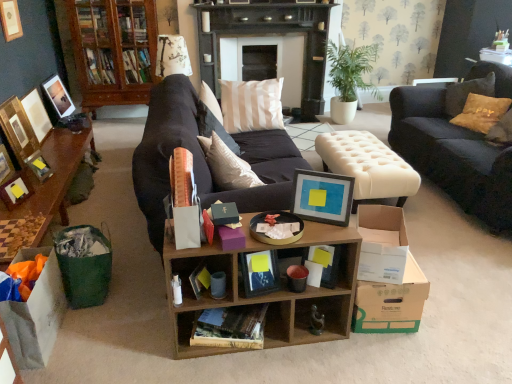
Describe the element at coordinates (367, 166) in the screenshot. I see `cream tufted ottoman at center` at that location.

Locate an element on the screen. This screenshot has height=384, width=512. matte plastic picture frame at center, which is the eighth picture frame in left-to-right order is located at coordinates (322, 197).

In order to face matte white picture frame at left, marked as the fifth picture frame in a right-to-left arrangement, should I rotate leftwards or rightwards?

Rotate your view left by about 28.859°.

Locate an element on the screen. This screenshot has height=384, width=512. green leafy plant at center is located at coordinates (349, 78).

Where is `cream tufted ottoman at center`? Image resolution: width=512 pixels, height=384 pixels. cream tufted ottoman at center is located at coordinates (367, 166).

Which object is wider, matte black picture frame at left, marked as the fifth picture frame in a left-to-right arrangement, or wooden cube shelf at center, which appears as the 2th shelf when viewed from the left?

Wider between the two is wooden cube shelf at center, which appears as the 2th shelf when viewed from the left.

Is matte black picture frame at left, the 4th picture frame in the right-to-left sequence, bigger or smaller than wooden cube shelf at center, arranged as the first shelf when viewed from the right?

In the image, matte black picture frame at left, the 4th picture frame in the right-to-left sequence, appears to be smaller than wooden cube shelf at center, arranged as the first shelf when viewed from the right.

Is matte black picture frame at left, the 4th picture frame in the right-to-left sequence, far away from wooden cube shelf at center, which appears as the 2th shelf when viewed from the left?

Indeed, matte black picture frame at left, the 4th picture frame in the right-to-left sequence, is not near wooden cube shelf at center, which appears as the 2th shelf when viewed from the left.

From the picture: Would you say matte black picture frame at left, marked as the fifth picture frame in a left-to-right arrangement, contains wooden cube shelf at center, arranged as the first shelf when viewed from the right?

No, wooden cube shelf at center, arranged as the first shelf when viewed from the right, is not a part of matte black picture frame at left, marked as the fifth picture frame in a left-to-right arrangement.

From the picture: Is matte black book at center, positioned as the 2th book in bottom-to-top order, not near dark wood fireplace at center?

Yes, matte black book at center, positioned as the 2th book in bottom-to-top order, and dark wood fireplace at center are quite far apart.

Is matte black book at center, which is the 1th book in top-to-bottom order, oriented away from dark wood fireplace at center?

Absolutely, matte black book at center, which is the 1th book in top-to-bottom order, is directed away from dark wood fireplace at center.

Is point (265, 259) closer to viewer compared to point (317, 39)?

Yes, point (265, 259) is in front of point (317, 39).

Is the position of matte black book at center, which is the 1th book in top-to-bottom order, more distant than that of dark wood fireplace at center?

No, it is in front of dark wood fireplace at center.

In the image, is wooden cube shelf at center, which appears as the 2th shelf when viewed from the right, positioned in front of or behind wooden cabinet at upper left?

wooden cube shelf at center, which appears as the 2th shelf when viewed from the right, is in front of wooden cabinet at upper left.

From the image's perspective, would you say wooden cube shelf at center, the first shelf viewed from the left, is positioned over wooden cabinet at upper left?

No, from the image's perspective, wooden cube shelf at center, the first shelf viewed from the left, is not on top of wooden cabinet at upper left.

From a real-world perspective, who is located lower, wooden cube shelf at center, the first shelf viewed from the left, or wooden cabinet at upper left?

wooden cube shelf at center, the first shelf viewed from the left, from a real-world perspective.

Who is bigger, wooden cube shelf at center, which appears as the 2th shelf when viewed from the right, or wooden cabinet at upper left?

With larger size is wooden cabinet at upper left.

Is matte black picture frame at left, the 4th picture frame in the right-to-left sequence, completely or partially outside of cream tufted ottoman at center?

matte black picture frame at left, the 4th picture frame in the right-to-left sequence, is positioned outside cream tufted ottoman at center.

Is matte black picture frame at left, marked as the fifth picture frame in a left-to-right arrangement, smaller than cream tufted ottoman at center?

Yes.

Is matte black picture frame at left, marked as the fifth picture frame in a left-to-right arrangement, wider than cream tufted ottoman at center?

Incorrect, the width of matte black picture frame at left, marked as the fifth picture frame in a left-to-right arrangement, does not surpass that of cream tufted ottoman at center.

In the scene shown: Are matte black picture frame at left, the 4th picture frame in the right-to-left sequence, and cream tufted ottoman at center far apart?

Yes, matte black picture frame at left, the 4th picture frame in the right-to-left sequence, and cream tufted ottoman at center are quite far apart.

Which object is further away from the camera taking this photo, cream tufted ottoman at center or matte black picture frame at left, the 3th picture frame viewed from the right?

cream tufted ottoman at center.

From the picture: Considering the relative sizes of cream tufted ottoman at center and matte black picture frame at left, arranged as the 6th picture frame when viewed from the left, in the image provided, is cream tufted ottoman at center smaller than matte black picture frame at left, arranged as the 6th picture frame when viewed from the left,?

Incorrect, cream tufted ottoman at center is not smaller in size than matte black picture frame at left, arranged as the 6th picture frame when viewed from the left.

Is cream tufted ottoman at center oriented towards matte black picture frame at left, the 3th picture frame viewed from the right?

No, cream tufted ottoman at center is not aimed at matte black picture frame at left, the 3th picture frame viewed from the right.

Which is behind, point (397, 155) or point (38, 174)?

The point (397, 155) is farther.

How different are the orientations of cardboard box at lower right, which ranks as the first cardboard box in right-to-left order, and matte black picture frame at upper left, which ranks as the 1th picture frame in left-to-right order, in degrees?

The angular difference between cardboard box at lower right, which ranks as the first cardboard box in right-to-left order, and matte black picture frame at upper left, which ranks as the 1th picture frame in left-to-right order, is 9.65 degrees.

Considering the points (387, 323) and (53, 100), which point is behind, point (387, 323) or point (53, 100)?

The point (53, 100) is more distant.

Does cardboard box at lower right, placed as the 3th cardboard box when sorted from left to right, have a greater height compared to matte black picture frame at upper left, the 8th picture frame from the right?

In fact, cardboard box at lower right, placed as the 3th cardboard box when sorted from left to right, may be shorter than matte black picture frame at upper left, the 8th picture frame from the right.

From the image's perspective, is cardboard box at lower right, placed as the 3th cardboard box when sorted from left to right, under matte black picture frame at upper left, the 8th picture frame from the right?

Yes.

Considering the positions of objects matte black picture frame at left, arranged as the 6th picture frame when viewed from the left, and white striped pillow at center in the image provided, who is more to the right, matte black picture frame at left, arranged as the 6th picture frame when viewed from the left, or white striped pillow at center?

white striped pillow at center is more to the right.

Are matte black picture frame at left, arranged as the 6th picture frame when viewed from the left, and white striped pillow at center far apart?

Yes.

From a real-world perspective, is matte black picture frame at left, arranged as the 6th picture frame when viewed from the left, below white striped pillow at center?

Yes, from a real-world perspective, matte black picture frame at left, arranged as the 6th picture frame when viewed from the left, is below white striped pillow at center.

From a real-world perspective, starting from the wooden cube shelf at center, arranged as the first shelf when viewed from the right, which picture frame is the 3rd one vertically above it? Please provide its 2D coordinates.

[(5, 165)]

Identify the location of entertainment center that appears on the right of matte black book at center, which is the 1th book in top-to-bottom order. (270, 33).

From the image, which object appears to be farther from matte black picture frame at left, marked as the 7th picture frame in a left-to-right arrangement, matte white picture frame at left, marked as the fifth picture frame in a right-to-left arrangement, or white paper bag at lower left, which ranks as the 3th cardboard box in right-to-left order?

white paper bag at lower left, which ranks as the 3th cardboard box in right-to-left order, is further to matte black picture frame at left, marked as the 7th picture frame in a left-to-right arrangement.

Which object lies further to the anchor point wooden cabinet at upper left, matte gold picture frame at upper left, the 7th picture frame positioned from the right, or matte black picture frame at left, arranged as the 6th picture frame when viewed from the left?

matte black picture frame at left, arranged as the 6th picture frame when viewed from the left, is positioned further to the anchor wooden cabinet at upper left.

Considering their positions, is matte black picture frame at left, the 4th picture frame in the right-to-left sequence, positioned closer to wooden cube shelf at center, which appears as the 2th shelf when viewed from the left, than cardboard box at center, arranged as the second cardboard box when viewed from the right?

cardboard box at center, arranged as the second cardboard box when viewed from the right, is closer to wooden cube shelf at center, which appears as the 2th shelf when viewed from the left.

Which object lies nearer to the anchor point dark wood fireplace at center, matte black picture frame at left, arranged as the 6th picture frame when viewed from the left, or green leafy plant at center?

green leafy plant at center lies closer to dark wood fireplace at center than the other object.

Estimate the real-world distances between objects in this image. Which object is closer to white paper bag at lower left, positioned as the first cardboard box in left-to-right order, matte gold picture frame at upper left, which is the 2th picture frame in left-to-right order, or matte black book at center, which is the 1th book in top-to-bottom order?

matte black book at center, which is the 1th book in top-to-bottom order, lies closer to white paper bag at lower left, positioned as the first cardboard box in left-to-right order, than the other object.

From the image, which object appears to be nearer to matte gold picture frame at upper left, the 7th picture frame positioned from the right, dark blue fabric couch at right or cream tufted ottoman at center?

cream tufted ottoman at center lies closer to matte gold picture frame at upper left, the 7th picture frame positioned from the right, than the other object.

Based on their spatial positions, is wooden cabinet at upper left or white striped pillow at center closer to matte white picture frame at left, marked as the fifth picture frame in a right-to-left arrangement?

The object closer to matte white picture frame at left, marked as the fifth picture frame in a right-to-left arrangement, is wooden cabinet at upper left.

Looking at this image, considering their positions, is matte black picture frame at upper left, the 8th picture frame from the right, positioned closer to cardboard box at lower right, placed as the 3th cardboard box when sorted from left to right, than wooden cube shelf at center, which appears as the 2th shelf when viewed from the left?

wooden cube shelf at center, which appears as the 2th shelf when viewed from the left, is positioned closer to the anchor cardboard box at lower right, placed as the 3th cardboard box when sorted from left to right.

You are a GUI agent. You are given a task and a screenshot of the screen. Output one action in this format:
    pyautogui.click(x=<x>, y=<y>)
    Task: Click on the book positioned between cardboard box at center, positioned as the 2th cardboard box in left-to-right order, and green leafy plant at center from near to far
    
    Given the screenshot: What is the action you would take?
    pyautogui.click(x=230, y=327)

Identify the location of picture frame between brown cardboard book at center, the first book in the bottom-to-top sequence, and cardboard box at lower right, which ranks as the first cardboard box in right-to-left order, in the horizontal direction. The height and width of the screenshot is (384, 512). (322, 197).

Where is `cabinetry situated between matte white picture frame at left, the 4th picture frame when ordered from left to right, and dark wood fireplace at center from left to right`? The height and width of the screenshot is (384, 512). cabinetry situated between matte white picture frame at left, the 4th picture frame when ordered from left to right, and dark wood fireplace at center from left to right is located at coordinates (113, 50).

Identify the location of houseplant between wooden cube shelf at center, arranged as the first shelf when viewed from the right, and wooden cabinet at upper left from front to back. (349, 78).